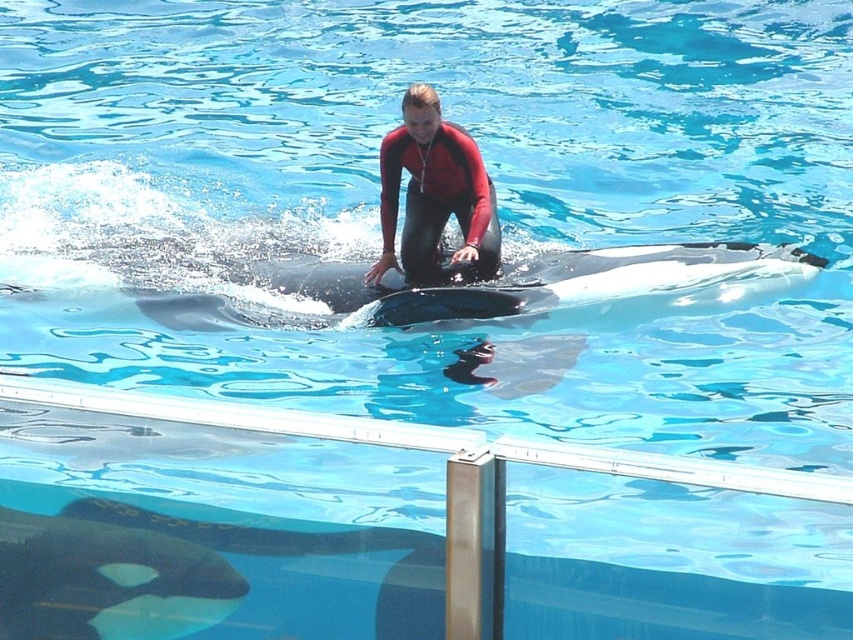
Question: Which of the following is the closest to the observer?

Choices:
 (A) (320, 296)
 (B) (433, 124)
 (C) (50, 563)

Answer: (C)

Question: Which object is farther from the camera taking this photo?

Choices:
 (A) black smooth whale at lower center
 (B) black smooth whale at center

Answer: (B)

Question: Does black smooth whale at center have a greater width compared to black smooth whale at lower center?

Choices:
 (A) yes
 (B) no

Answer: (B)

Question: Is black smooth whale at center thinner than red matte wetsuit at center?

Choices:
 (A) no
 (B) yes

Answer: (B)

Question: In this image, where is black smooth whale at center located relative to black smooth whale at lower center?

Choices:
 (A) left
 (B) right

Answer: (B)

Question: Which of the following is the closest to the observer?

Choices:
 (A) black smooth whale at lower center
 (B) black smooth whale at center
 (C) red matte wetsuit at center

Answer: (A)